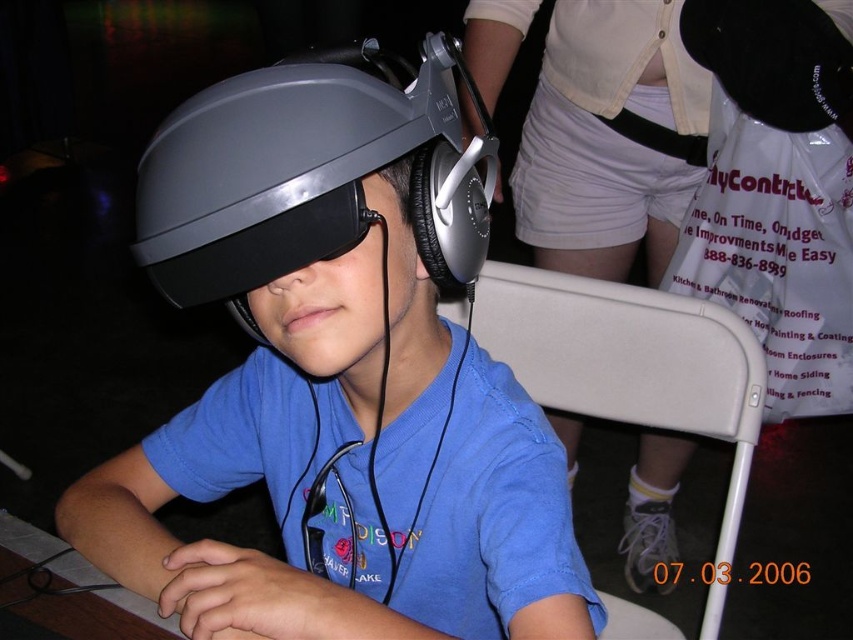
What do you see at coordinates (337, 380) in the screenshot?
I see `matte black headset at center` at bounding box center [337, 380].

What are the coordinates of `matte black headset at center` in the screenshot? It's located at (337, 380).

This screenshot has width=853, height=640. Find the location of `matte black headset at center`. matte black headset at center is located at coordinates (337, 380).